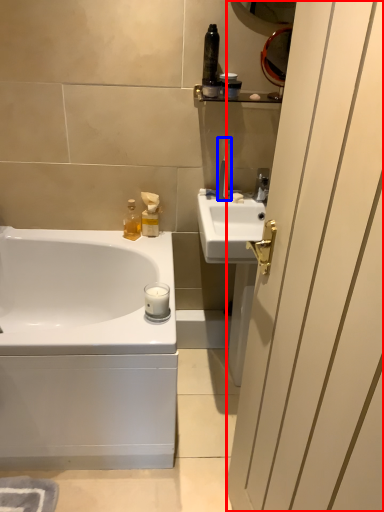
Question: Which object is closer to the camera taking this photo, screen door (highlighted by a red box) or toothbrush (highlighted by a blue box)?

Choices:
 (A) screen door
 (B) toothbrush

Answer: (A)